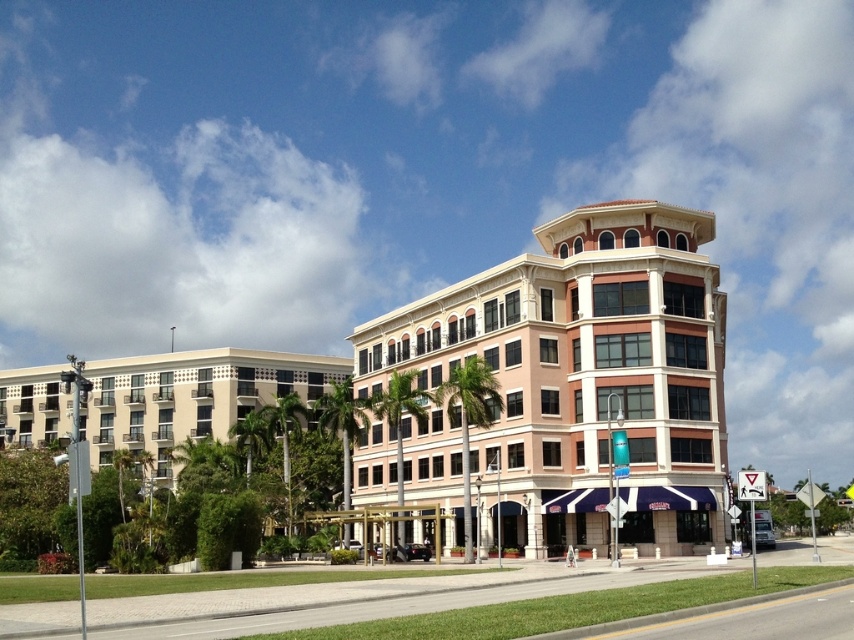
Does beige stone building at center have a lesser width compared to beige concrete building at left?

Yes, beige stone building at center is thinner than beige concrete building at left.

Locate an element on the screen. This screenshot has height=640, width=854. beige stone building at center is located at coordinates click(576, 378).

Where is `beige stone building at center`? This screenshot has width=854, height=640. beige stone building at center is located at coordinates (576, 378).